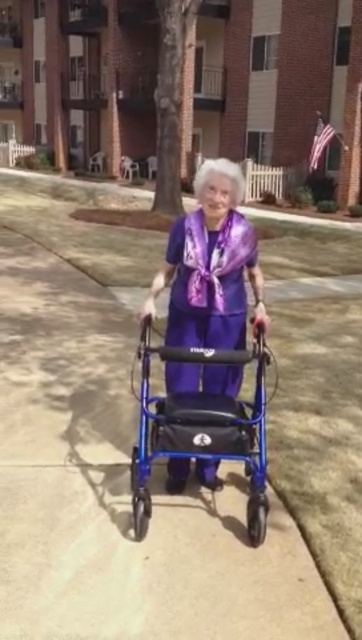
You are a delivery person trying to navigate through the path where the purple fabric walker at center and the blue metallic walker at center are located. Which walker should you avoid stepping closer to if you want to stay closer to the foreground?

You should avoid stepping closer to the purple fabric walker at center because it is closer to the foreground compared to the blue metallic walker at center.